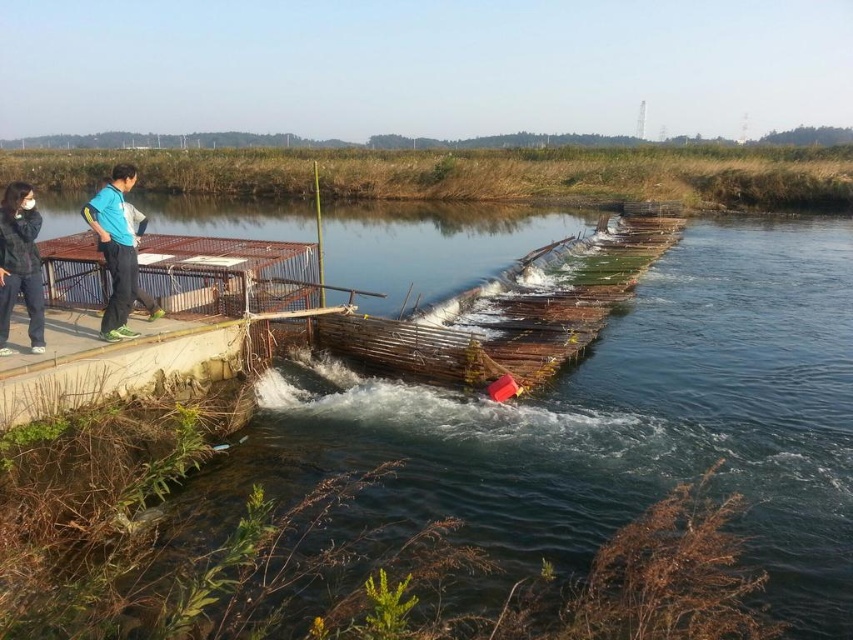
You are a photographer wanting to capture both the dark blue fabric couple at left and the dark gray fleece jacket at left in the same frame. Which object should you focus on first to ensure both are in focus?

The dark gray fleece jacket at left is behind the dark blue fabric couple at left, so you should focus on the dark gray fleece jacket at left first to ensure both are in focus.

You are standing at the edge of the water management structure and want to reach the dark blue fabric couple at left. The path you need to take is 7.15 meters long. If you walk at a speed of 1.5 meters per second, how many seconds will it take you to reach them?

The distance between you and the dark blue fabric couple at left is 7.15 meters. Walking at 1.5 meters per second, it would take approximately 4.77 seconds to reach them.

What is the color of the fabric couple located at point (115, 250) in the image?

The fabric couple at point (115, 250) is dark blue.